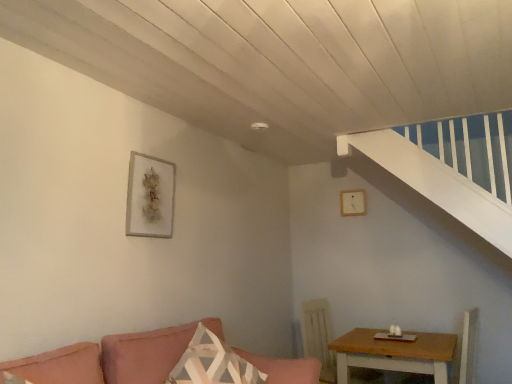
What do you see at coordinates (353, 202) in the screenshot?
I see `matte white picture frame at upper center, placed as the first picture frame when sorted from right to left` at bounding box center [353, 202].

Identify the location of matte gray picture frame at upper left, marked as the second picture frame in a right-to-left arrangement. (150, 197).

From the image's perspective, which is above, patterned fabric pillow at center or matte gray picture frame at upper left, marked as the 2th picture frame in a back-to-front arrangement?

matte gray picture frame at upper left, marked as the 2th picture frame in a back-to-front arrangement.

In terms of size, does patterned fabric pillow at center appear bigger or smaller than matte gray picture frame at upper left, the first picture frame in the front-to-back sequence?

patterned fabric pillow at center is bigger than matte gray picture frame at upper left, the first picture frame in the front-to-back sequence.

From a real-world perspective, who is located lower, patterned fabric pillow at center or matte gray picture frame at upper left, the first picture frame in the front-to-back sequence?

In real-world perspective, patterned fabric pillow at center is lower.

Which is more distant, (258, 383) or (135, 174)?

The point (135, 174) is more distant.

From the image's perspective, between matte gray picture frame at upper left, marked as the first picture frame in a left-to-right arrangement, and light brown wooden table at lower right, which one is located above?

matte gray picture frame at upper left, marked as the first picture frame in a left-to-right arrangement, appears higher in the image.

From a real-world perspective, between matte gray picture frame at upper left, marked as the first picture frame in a left-to-right arrangement, and light brown wooden table at lower right, who is vertically higher?

matte gray picture frame at upper left, marked as the first picture frame in a left-to-right arrangement, is physically above.

Who is more distant, matte gray picture frame at upper left, marked as the second picture frame in a right-to-left arrangement, or light brown wooden table at lower right?

light brown wooden table at lower right is behind.

In terms of height, does light brown wooden table at lower right look taller or shorter compared to patterned fabric pillow at center?

Considering their sizes, light brown wooden table at lower right has more height than patterned fabric pillow at center.

Would you consider light brown wooden table at lower right to be distant from patterned fabric pillow at center?

light brown wooden table at lower right is positioned a significant distance from patterned fabric pillow at center.

Is patterned fabric pillow at center located within light brown wooden table at lower right?

That's incorrect, patterned fabric pillow at center is not inside light brown wooden table at lower right.

Considering the points (418, 334) and (181, 369), which point is behind, point (418, 334) or point (181, 369)?

Point (418, 334)

Between matte white picture frame at upper center, which is the second picture frame from front to back, and patterned fabric pillow at center, which one has smaller size?

matte white picture frame at upper center, which is the second picture frame from front to back, is smaller.

Are matte white picture frame at upper center, which is the second picture frame from front to back, and patterned fabric pillow at center located far from each other?

Absolutely, matte white picture frame at upper center, which is the second picture frame from front to back, is distant from patterned fabric pillow at center.

Which is behind, point (353, 210) or point (205, 372)?

The point (353, 210) is farther.

How different are the orientations of patterned fabric pillow at center and pink fabric couch at lower left in degrees?

They differ by 22.8 degrees in their facing directions.

Which point is more distant from viewer, (218, 338) or (118, 360)?

The point (218, 338) is farther from the camera.

Is patterned fabric pillow at center not inside pink fabric couch at lower left?

Actually, patterned fabric pillow at center is at least partially inside pink fabric couch at lower left.

Consider the image. From the image's perspective, is patterned fabric pillow at center under pink fabric couch at lower left?

No, from the image's perspective, patterned fabric pillow at center is not beneath pink fabric couch at lower left.

Can you tell me how much matte gray picture frame at upper left, the first picture frame in the front-to-back sequence, and patterned fabric pillow at center differ in facing direction?

The angular difference between matte gray picture frame at upper left, the first picture frame in the front-to-back sequence, and patterned fabric pillow at center is 22.9 degrees.

Is matte gray picture frame at upper left, marked as the first picture frame in a left-to-right arrangement, not inside patterned fabric pillow at center?

Indeed, matte gray picture frame at upper left, marked as the first picture frame in a left-to-right arrangement, is completely outside patterned fabric pillow at center.

Who is smaller, matte gray picture frame at upper left, marked as the 2th picture frame in a back-to-front arrangement, or patterned fabric pillow at center?

With smaller size is matte gray picture frame at upper left, marked as the 2th picture frame in a back-to-front arrangement.

Does matte gray picture frame at upper left, marked as the first picture frame in a left-to-right arrangement, have a lesser width compared to patterned fabric pillow at center?

Indeed, matte gray picture frame at upper left, marked as the first picture frame in a left-to-right arrangement, has a lesser width compared to patterned fabric pillow at center.

Does matte gray picture frame at upper left, marked as the first picture frame in a left-to-right arrangement, have a greater height compared to matte white picture frame at upper center, placed as the first picture frame when sorted from right to left?

Yes, matte gray picture frame at upper left, marked as the first picture frame in a left-to-right arrangement, is taller than matte white picture frame at upper center, placed as the first picture frame when sorted from right to left.

Is matte gray picture frame at upper left, marked as the 2th picture frame in a back-to-front arrangement, surrounding matte white picture frame at upper center, which is the 2th picture frame in left-to-right order?

Definitely not — matte white picture frame at upper center, which is the 2th picture frame in left-to-right order, is not inside matte gray picture frame at upper left, marked as the 2th picture frame in a back-to-front arrangement.

Does matte gray picture frame at upper left, the first picture frame in the front-to-back sequence, have a greater width compared to matte white picture frame at upper center, placed as the first picture frame when sorted from right to left?

Correct, the width of matte gray picture frame at upper left, the first picture frame in the front-to-back sequence, exceeds that of matte white picture frame at upper center, placed as the first picture frame when sorted from right to left.

Is matte gray picture frame at upper left, the first picture frame in the front-to-back sequence, positioned with its back to matte white picture frame at upper center, placed as the first picture frame when sorted from right to left?

matte gray picture frame at upper left, the first picture frame in the front-to-back sequence, does not have its back to matte white picture frame at upper center, placed as the first picture frame when sorted from right to left.

From a real-world perspective, which picture frame is the 1st one above the patterned fabric pillow at center? Please provide its 2D coordinates.

[(150, 197)]

At what (x,y) coordinates should I click in order to perform the action: click on the 2nd picture frame to the left of the light brown wooden table at lower right, starting your count from the anchor. Please return your answer as a coordinate pair (x, y). Looking at the image, I should click on (150, 197).

Which object lies nearer to the anchor point matte gray picture frame at upper left, the first picture frame in the front-to-back sequence, pink fabric couch at lower left or light brown wooden table at lower right?

pink fabric couch at lower left.

Based on the photo, looking at the image, which one is located further to light brown wooden table at lower right, matte gray picture frame at upper left, marked as the second picture frame in a right-to-left arrangement, or patterned fabric pillow at center?

The object further to light brown wooden table at lower right is matte gray picture frame at upper left, marked as the second picture frame in a right-to-left arrangement.

Estimate the real-world distances between objects in this image. Which object is further from matte gray picture frame at upper left, marked as the second picture frame in a right-to-left arrangement, pink fabric couch at lower left or patterned fabric pillow at center?

patterned fabric pillow at center lies further to matte gray picture frame at upper left, marked as the second picture frame in a right-to-left arrangement, than the other object.

Looking at the image, which one is located further to matte white picture frame at upper center, placed as the first picture frame when sorted from right to left, light brown wooden table at lower right or pink fabric couch at lower left?

pink fabric couch at lower left lies further to matte white picture frame at upper center, placed as the first picture frame when sorted from right to left, than the other object.

When comparing their distances from matte white picture frame at upper center, which is counted as the first picture frame, starting from the back, does light brown wooden table at lower right or matte gray picture frame at upper left, the first picture frame in the front-to-back sequence, seem closer?

Based on the image, light brown wooden table at lower right appears to be nearer to matte white picture frame at upper center, which is counted as the first picture frame, starting from the back.

From the image, which object appears to be nearer to pink fabric couch at lower left, matte gray picture frame at upper left, marked as the second picture frame in a right-to-left arrangement, or patterned fabric pillow at center?

Among the two, patterned fabric pillow at center is located nearer to pink fabric couch at lower left.

From the image, which object appears to be farther from matte white picture frame at upper center, placed as the first picture frame when sorted from right to left, pink fabric couch at lower left or patterned fabric pillow at center?

Among the two, patterned fabric pillow at center is located further to matte white picture frame at upper center, placed as the first picture frame when sorted from right to left.

From the image, which object appears to be nearer to light brown wooden table at lower right, patterned fabric pillow at center or matte white picture frame at upper center, which is the second picture frame from front to back?

patterned fabric pillow at center is positioned closer to the anchor light brown wooden table at lower right.

Locate an element on the screen. This screenshot has height=384, width=512. pillow between pink fabric couch at lower left and matte white picture frame at upper center, placed as the first picture frame when sorted from right to left, from front to back is located at coordinates (213, 363).

Where is `picture frame between pink fabric couch at lower left and matte white picture frame at upper center, which is the second picture frame from front to back, in the front-back direction`? picture frame between pink fabric couch at lower left and matte white picture frame at upper center, which is the second picture frame from front to back, in the front-back direction is located at coordinates (150, 197).

At what (x,y) coordinates should I click in order to perform the action: click on pillow located between matte gray picture frame at upper left, marked as the 2th picture frame in a back-to-front arrangement, and light brown wooden table at lower right in the left-right direction. Please return your answer as a coordinate pair (x, y). The width and height of the screenshot is (512, 384). Looking at the image, I should click on (213, 363).

In order to click on pillow between pink fabric couch at lower left and light brown wooden table at lower right from front to back in this screenshot , I will do `click(213, 363)`.